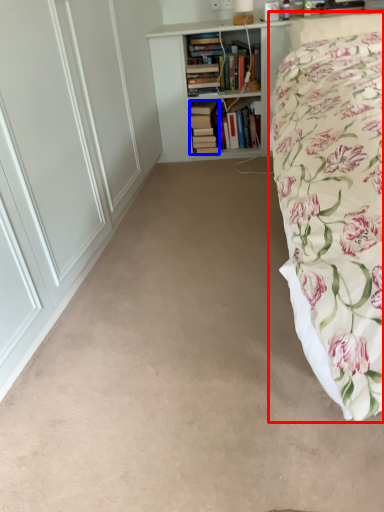
Question: Which point is further to the camera, bed (highlighted by a red box) or book (highlighted by a blue box)?

Choices:
 (A) bed
 (B) book

Answer: (B)